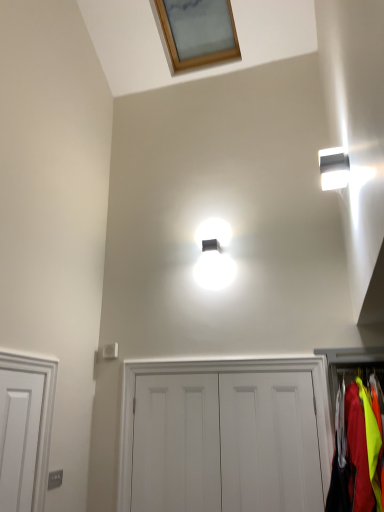
Question: Are white matte door at center, acting as the 2th door starting from the right, and wooden frame at upper center making contact?

Choices:
 (A) no
 (B) yes

Answer: (A)

Question: Does white matte door at center, acting as the 2th door starting from the right, appear on the left side of wooden frame at upper center?

Choices:
 (A) yes
 (B) no

Answer: (B)

Question: Could you tell me if white matte door at center, acting as the 2th door starting from the right, is facing wooden frame at upper center?

Choices:
 (A) yes
 (B) no

Answer: (B)

Question: Considering the relative sizes of white matte door at center, acting as the 2th door starting from the right, and wooden frame at upper center in the image provided, is white matte door at center, acting as the 2th door starting from the right, shorter than wooden frame at upper center?

Choices:
 (A) no
 (B) yes

Answer: (A)

Question: Can you confirm if white matte door at center, acting as the 2th door starting from the right, is bigger than wooden frame at upper center?

Choices:
 (A) yes
 (B) no

Answer: (B)

Question: Considering the positions of point (344, 158) and point (340, 443), is point (344, 158) closer or farther from the camera than point (340, 443)?

Choices:
 (A) farther
 (B) closer

Answer: (B)

Question: Is white glossy light fixture at upper right inside the boundaries of neon yellow fabric at right, or outside?

Choices:
 (A) outside
 (B) inside

Answer: (A)

Question: In terms of size, does white glossy light fixture at upper right appear bigger or smaller than neon yellow fabric at right?

Choices:
 (A) small
 (B) big

Answer: (A)

Question: Based on their positions, is white glossy light fixture at upper right located to the left or right of neon yellow fabric at right?

Choices:
 (A) left
 (B) right

Answer: (A)

Question: From a real-world perspective, is white matte door at center, acting as the third door starting from the right, physically located above or below white glossy light fixture at upper right?

Choices:
 (A) above
 (B) below

Answer: (B)

Question: Is white matte door at center, the 1th door when ordered from left to right, inside or outside of white glossy light fixture at upper right?

Choices:
 (A) inside
 (B) outside

Answer: (B)

Question: From the image's perspective, is white matte door at center, acting as the third door starting from the right, positioned above or below white glossy light fixture at upper right?

Choices:
 (A) below
 (B) above

Answer: (A)

Question: Does point (183, 456) appear closer or farther from the camera than point (327, 177)?

Choices:
 (A) farther
 (B) closer

Answer: (A)

Question: In terms of height, does neon yellow fabric at right look taller or shorter compared to white matte door at center, which is counted as the third door, starting from the left?

Choices:
 (A) tall
 (B) short

Answer: (B)

Question: In the image, is neon yellow fabric at right positioned in front of or behind white matte door at center, which is counted as the third door, starting from the left?

Choices:
 (A) front
 (B) behind

Answer: (A)